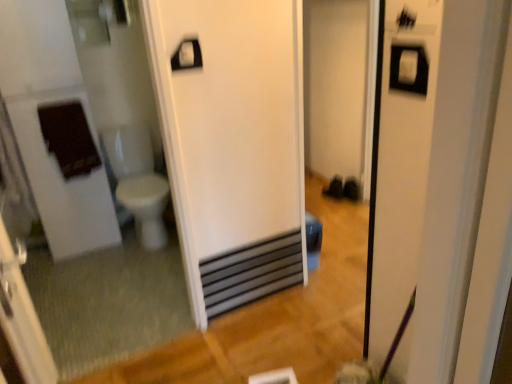
Where is `white glossy mirror at left`? The width and height of the screenshot is (512, 384). white glossy mirror at left is located at coordinates (88, 192).

The image size is (512, 384). What do you see at coordinates (187, 55) in the screenshot?
I see `white plastic towel bar at upper center` at bounding box center [187, 55].

You are a GUI agent. You are given a task and a screenshot of the screen. Output one action in this format:
    pyautogui.click(x=<x>, y=<y>)
    Task: Click on the black metallic water heater at center
    
    Given the screenshot: What is the action you would take?
    pyautogui.click(x=251, y=273)

In the image, there is a white plastic towel bar at upper center. At what (x,y) coordinates should I click in order to perform the action: click on screen door below it (from a real-world perspective). Please return your answer as a coordinate pair (x, y). Image resolution: width=512 pixels, height=384 pixels. Looking at the image, I should click on (22, 319).

Can you confirm if transparent plastic screen door at left is thinner than white plastic towel bar at upper center?

Incorrect, the width of transparent plastic screen door at left is not less than that of white plastic towel bar at upper center.

Is transparent plastic screen door at left with white plastic towel bar at upper center?

No, transparent plastic screen door at left is not touching white plastic towel bar at upper center.

Considering the sizes of objects white glossy toilet bowl at left and white plastic towel bar at upper center in the image provided, who is taller, white glossy toilet bowl at left or white plastic towel bar at upper center?

With more height is white glossy toilet bowl at left.

From the image's perspective, which is below, white glossy toilet bowl at left or white plastic towel bar at upper center?

white glossy toilet bowl at left, from the image's perspective.

Is white plastic towel bar at upper center at the back of white glossy toilet bowl at left?

No, white glossy toilet bowl at left is not facing away from white plastic towel bar at upper center.

Is white glossy mirror at left at the left side of white plastic towel bar at upper center?

Correct, you'll find white glossy mirror at left to the left of white plastic towel bar at upper center.

Considering their positions, is white glossy mirror at left located in front of or behind white plastic towel bar at upper center?

Clearly, white glossy mirror at left is in front of white plastic towel bar at upper center.

Which point is more distant from viewer, (164, 291) or (189, 43)?

The point (164, 291) is more distant.

Between white glossy mirror at left and white plastic towel bar at upper center, which one has larger size?

white glossy mirror at left is bigger.

In the image, is black metallic water heater at center positioned in front of or behind white glossy mirror at left?

Visually, black metallic water heater at center is located behind white glossy mirror at left.

The height and width of the screenshot is (384, 512). I want to click on water heater below the white glossy mirror at left (from the image's perspective), so click(x=251, y=273).

From a real-world perspective, is black metallic water heater at center positioned above or below white glossy mirror at left?

From a real-world perspective, black metallic water heater at center is physically below white glossy mirror at left.

Between black metallic water heater at center and white glossy mirror at left, which one appears on the right side from the viewer's perspective?

black metallic water heater at center is more to the right.

Can you confirm if transparent plastic screen door at left is positioned to the right of white glossy toilet bowl at left?

Yes.

From a real-world perspective, is transparent plastic screen door at left positioned over white glossy toilet bowl at left based on gravity?

Indeed, from a real-world perspective, transparent plastic screen door at left stands above white glossy toilet bowl at left.

In the scene shown: From the image's perspective, between transparent plastic screen door at left and white glossy toilet bowl at left, who is located below?

transparent plastic screen door at left, from the image's perspective.

Relative to white glossy toilet bowl at left, is transparent plastic screen door at left in front or behind?

transparent plastic screen door at left is positioned closer to the viewer than white glossy toilet bowl at left.

Between white plastic towel bar at upper center and transparent plastic screen door at left, which one appears on the right side from the viewer's perspective?

white plastic towel bar at upper center.

Who is bigger, white plastic towel bar at upper center or transparent plastic screen door at left?

transparent plastic screen door at left.

From the picture: Can you tell me how much white plastic towel bar at upper center and transparent plastic screen door at left differ in facing direction?

95.6 degrees.

You are a GUI agent. You are given a task and a screenshot of the screen. Output one action in this format:
    pyautogui.click(x=<x>, y=<y>)
    Task: Click on the screen door that is below the white plastic towel bar at upper center (from the image's perspective)
    
    Given the screenshot: What is the action you would take?
    pyautogui.click(x=22, y=319)

Is black metallic water heater at center thinner than transparent plastic screen door at left?

Correct, the width of black metallic water heater at center is less than that of transparent plastic screen door at left.

Do you think black metallic water heater at center is within transparent plastic screen door at left, or outside of it?

black metallic water heater at center is not inside transparent plastic screen door at left, it's outside.

From the image's perspective, does black metallic water heater at center appear lower than transparent plastic screen door at left?

Yes.

Can you tell me how much black metallic water heater at center and transparent plastic screen door at left differ in facing direction?

95.6 degrees separate the facing orientations of black metallic water heater at center and transparent plastic screen door at left.

The height and width of the screenshot is (384, 512). I want to click on screen door located in front of the white plastic towel bar at upper center, so click(22, 319).

Locate an element on the screen. towel bar located above the white glossy toilet bowl at left (from the image's perspective) is located at coordinates (187, 55).

When comparing their distances from white plastic towel bar at upper center, does black metallic water heater at center or white glossy toilet bowl at left seem further?

Based on the image, white glossy toilet bowl at left appears to be further to white plastic towel bar at upper center.

Looking at the image, which one is located further to white plastic towel bar at upper center, white glossy toilet bowl at left or transparent plastic screen door at left?

white glossy toilet bowl at left is positioned further to the anchor white plastic towel bar at upper center.

From the image, which object appears to be farther from transparent plastic screen door at left, black metallic water heater at center or white glossy toilet bowl at left?

The object further to transparent plastic screen door at left is white glossy toilet bowl at left.

Based on their spatial positions, is white plastic towel bar at upper center or transparent plastic screen door at left further from black metallic water heater at center?

transparent plastic screen door at left lies further to black metallic water heater at center than the other object.

From the image, which object appears to be farther from transparent plastic screen door at left, black metallic water heater at center or white glossy mirror at left?

white glossy mirror at left.

From the image, which object appears to be nearer to transparent plastic screen door at left, white plastic towel bar at upper center or black metallic water heater at center?

Based on the image, white plastic towel bar at upper center appears to be nearer to transparent plastic screen door at left.

Which object lies nearer to the anchor point white glossy mirror at left, white plastic towel bar at upper center or black metallic water heater at center?

black metallic water heater at center.

Which object lies further to the anchor point transparent plastic screen door at left, white glossy toilet bowl at left or black metallic water heater at center?

white glossy toilet bowl at left.

You are a GUI agent. You are given a task and a screenshot of the screen. Output one action in this format:
    pyautogui.click(x=<x>, y=<y>)
    Task: Click on the toilet bowl between white plastic towel bar at upper center and black metallic water heater at center in the up-down direction
    
    Given the screenshot: What is the action you would take?
    pyautogui.click(x=138, y=181)

Where is `mirror located between transparent plastic screen door at left and black metallic water heater at center in the depth direction`? The height and width of the screenshot is (384, 512). mirror located between transparent plastic screen door at left and black metallic water heater at center in the depth direction is located at coordinates (88, 192).

Identify the location of mirror between transparent plastic screen door at left and white glossy toilet bowl at left along the z-axis. (88, 192).

I want to click on water heater between transparent plastic screen door at left and white glossy toilet bowl at left in the front-back direction, so coord(251,273).